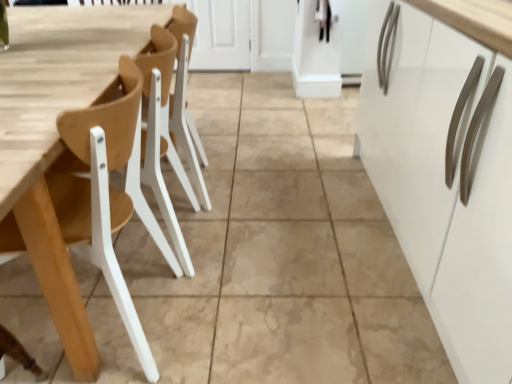
Locate an element on the screen. The image size is (512, 384). spots to the right of natural wood table at left is located at coordinates (241, 244).